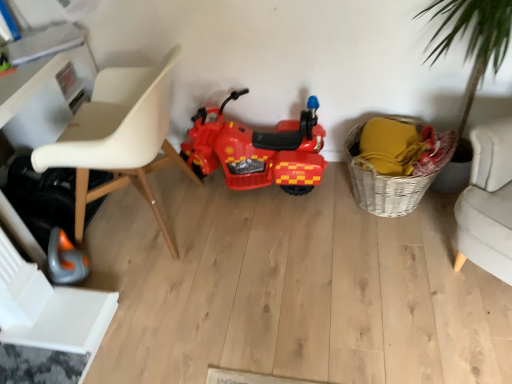
This screenshot has height=384, width=512. I want to click on vacant area that is in front of woven basket at lower right, so click(x=405, y=267).